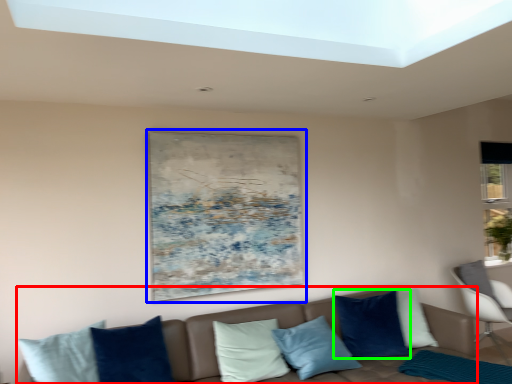
Question: Which object is positioned closest to studio couch (highlighted by a red box)? Select from picture frame (highlighted by a blue box) and pillow (highlighted by a green box).

Choices:
 (A) picture frame
 (B) pillow

Answer: (B)